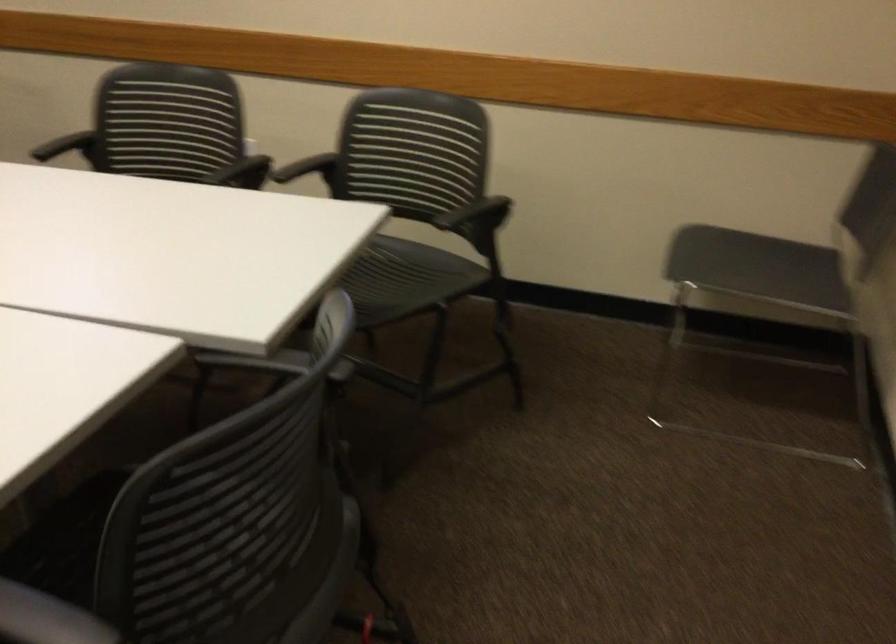
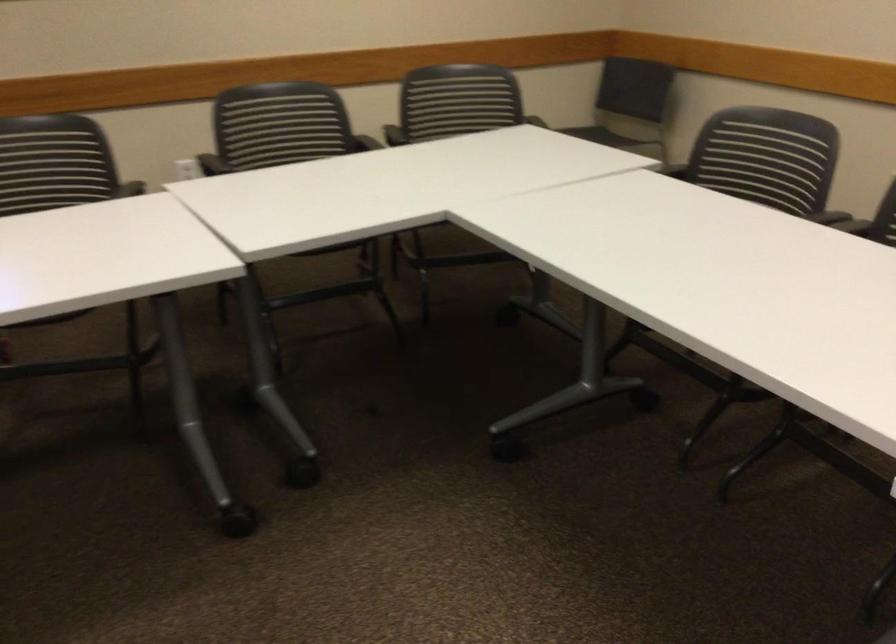
Find the pixel in the second image that matches (x=726, y=203) in the first image.

(529, 113)